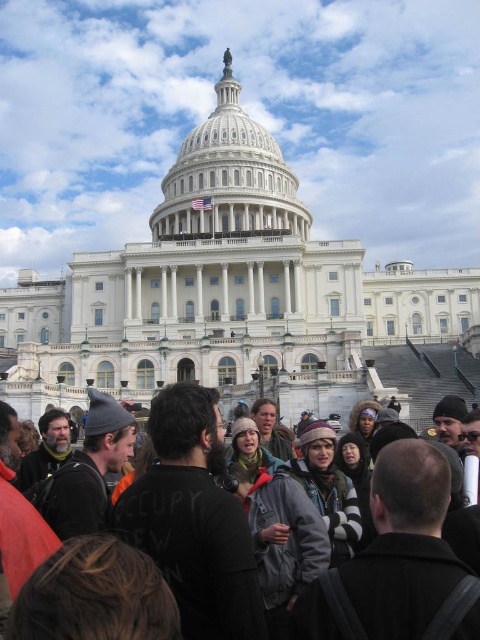
Question: Does dark gray knit hat at center appear under white marble dome at center?

Choices:
 (A) yes
 (B) no

Answer: (A)

Question: Which point is farther to the camera?

Choices:
 (A) white marble dome at center
 (B) dark gray knit hat at center

Answer: (A)

Question: Can you confirm if dark gray knit hat at center is positioned to the right of white marble dome at center?

Choices:
 (A) no
 (B) yes

Answer: (B)

Question: Among these points, which one is farthest from the camera?

Choices:
 (A) (173, 192)
 (B) (205, 440)

Answer: (A)

Question: Observing the image, what is the correct spatial positioning of dark gray knit hat at center in reference to white marble dome at center?

Choices:
 (A) above
 (B) below

Answer: (B)